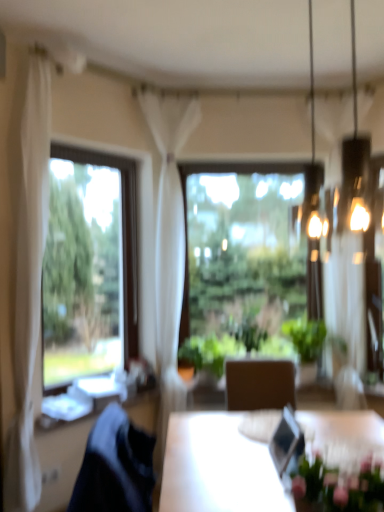
Question: Is pink matte floral arrangement at lower right wider than metallic glass chandelier at upper right?

Choices:
 (A) yes
 (B) no

Answer: (B)

Question: Would you say pink matte floral arrangement at lower right contains metallic glass chandelier at upper right?

Choices:
 (A) no
 (B) yes

Answer: (A)

Question: Can you confirm if pink matte floral arrangement at lower right is shorter than metallic glass chandelier at upper right?

Choices:
 (A) no
 (B) yes

Answer: (B)

Question: Is pink matte floral arrangement at lower right to the left of metallic glass chandelier at upper right from the viewer's perspective?

Choices:
 (A) yes
 (B) no

Answer: (A)

Question: Does pink matte floral arrangement at lower right appear on the right side of metallic glass chandelier at upper right?

Choices:
 (A) no
 (B) yes

Answer: (A)

Question: Is pink matte floral arrangement at lower right positioned with its back to metallic glass chandelier at upper right?

Choices:
 (A) no
 (B) yes

Answer: (A)

Question: From a real-world perspective, is white sheer curtain at center, marked as the 2th curtain in a front-to-back arrangement, under pink matte floral arrangement at lower right?

Choices:
 (A) no
 (B) yes

Answer: (A)

Question: Is white sheer curtain at center, which appears as the first curtain when viewed from the back, smaller than pink matte floral arrangement at lower right?

Choices:
 (A) yes
 (B) no

Answer: (B)

Question: Does white sheer curtain at center, marked as the 2th curtain in a front-to-back arrangement, come behind pink matte floral arrangement at lower right?

Choices:
 (A) yes
 (B) no

Answer: (A)

Question: Could you tell me if white sheer curtain at center, the second curtain in the left-to-right sequence, is facing pink matte floral arrangement at lower right?

Choices:
 (A) yes
 (B) no

Answer: (A)

Question: Considering the relative positions of white sheer curtain at center, the second curtain in the left-to-right sequence, and pink matte floral arrangement at lower right in the image provided, is white sheer curtain at center, the second curtain in the left-to-right sequence, to the right of pink matte floral arrangement at lower right from the viewer's perspective?

Choices:
 (A) yes
 (B) no

Answer: (B)

Question: Is white sheer curtain at center, marked as the 2th curtain in a front-to-back arrangement, facing away from pink matte floral arrangement at lower right?

Choices:
 (A) no
 (B) yes

Answer: (A)

Question: From a real-world perspective, is transparent glass window at center, placed as the 1th window when sorted from back to front, under pink matte floral arrangement at lower right?

Choices:
 (A) yes
 (B) no

Answer: (B)